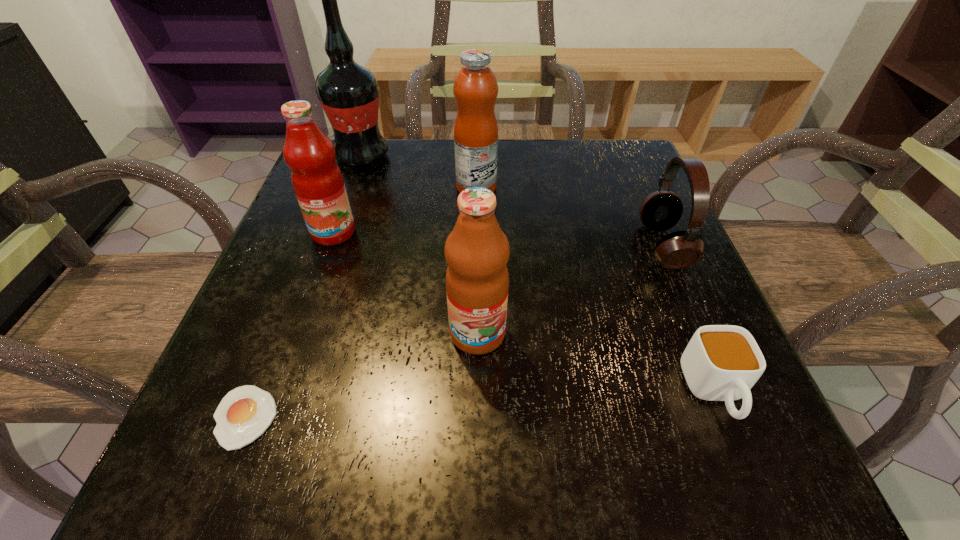
At what (x,y) coordinates should I click in order to perform the action: click on the farthest object. Please return your answer as a coordinate pair (x, y). Looking at the image, I should click on (348, 92).

You are a GUI agent. You are given a task and a screenshot of the screen. Output one action in this format:
    pyautogui.click(x=<x>, y=<y>)
    Task: Click on the wine bottle
    The height and width of the screenshot is (540, 960).
    Given the screenshot: What is the action you would take?
    pyautogui.click(x=348, y=92)

This screenshot has width=960, height=540. Identify the location of the farthest fruit juice. (475, 88).

Locate an element on the screen. This screenshot has width=960, height=540. the nearest fruit juice is located at coordinates (477, 251).

Where is `the leftmost fruit juice`? The width and height of the screenshot is (960, 540). the leftmost fruit juice is located at coordinates (317, 180).

At what (x,y) coordinates should I click in order to perform the action: click on the third shortest object. Please return your answer as a coordinate pair (x, y). Image resolution: width=960 pixels, height=540 pixels. Looking at the image, I should click on (661, 210).

Where is `cup`? The height and width of the screenshot is (540, 960). cup is located at coordinates (721, 362).

Locate an element on the screen. egg yolk is located at coordinates (244, 413).

Where is `free space located on the front of the farthest object`? Image resolution: width=960 pixels, height=540 pixels. free space located on the front of the farthest object is located at coordinates (348, 195).

You are a GUI agent. You are given a task and a screenshot of the screen. Output one action in this format:
    pyautogui.click(x=<x>, y=<y>)
    Task: Click on the vacant space located on the front label of the farthest fruit juice
    The image size is (960, 540).
    Given the screenshot: What is the action you would take?
    pyautogui.click(x=650, y=187)